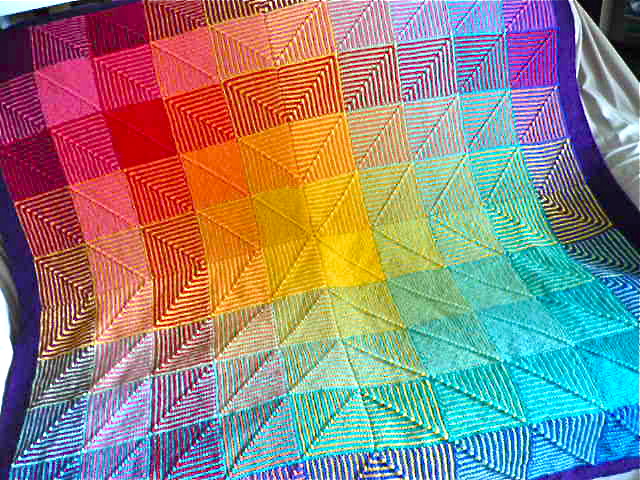
At what (x,y) coordinates should I click in order to perform the action: click on rainbow quilt. Please return your answer as a coordinate pair (x, y). Looking at the image, I should click on (352, 220).